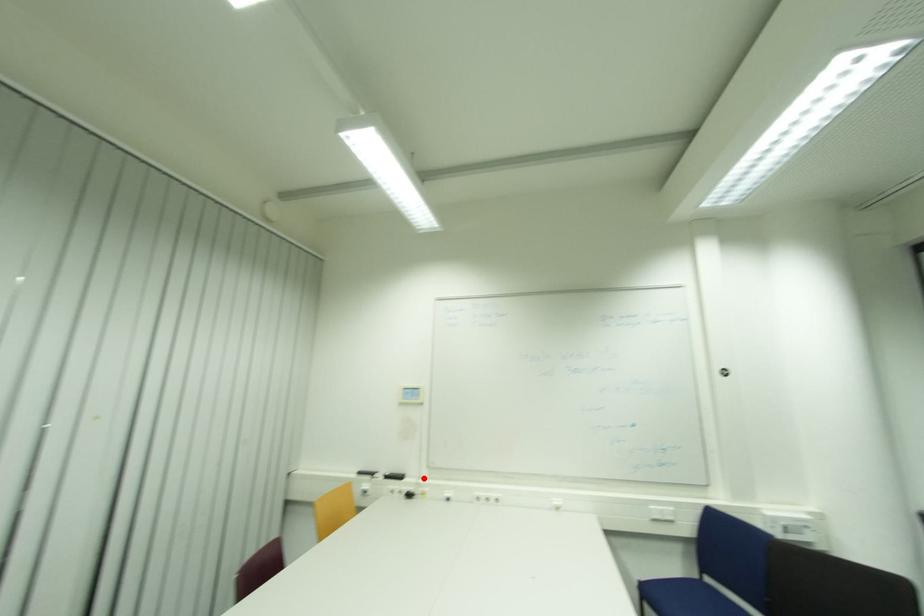
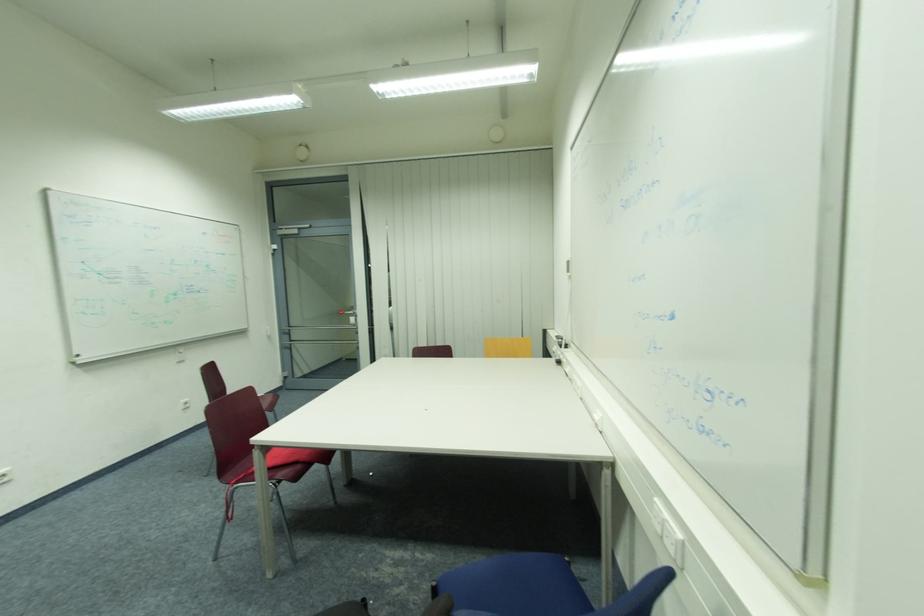
The point at the highlighted location is marked in the first image. Where is the corresponding point in the second image?

(578, 352)